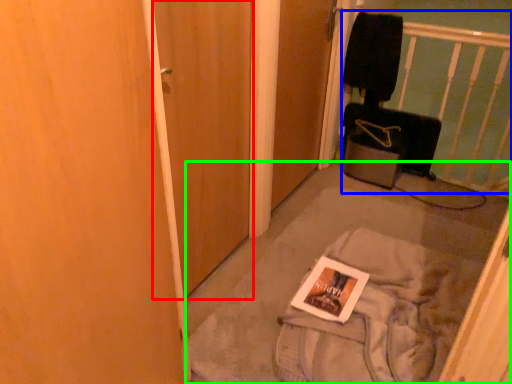
Question: Based on their relative distances, which object is nearer to door (highlighted by a red box)? Choose from infant bed (highlighted by a blue box) and concrete (highlighted by a green box).

Choices:
 (A) infant bed
 (B) concrete

Answer: (B)